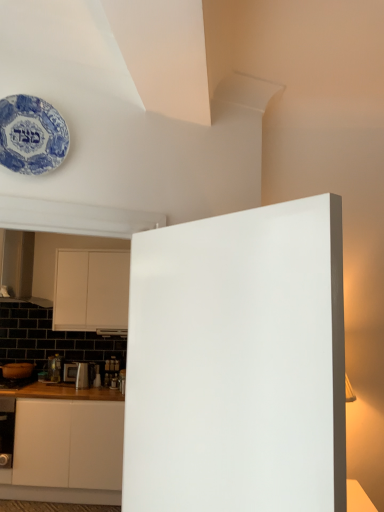
Question: In terms of height, does metallic silver toaster at lower left look taller or shorter compared to white matte cabinet at left?

Choices:
 (A) short
 (B) tall

Answer: (A)

Question: Considering the relative positions of metallic silver toaster at lower left and white matte cabinet at left in the image provided, is metallic silver toaster at lower left to the left or to the right of white matte cabinet at left?

Choices:
 (A) left
 (B) right

Answer: (A)

Question: Estimate the real-world distances between objects in this image. Which object is closer to the white matte cabinet at left?

Choices:
 (A) metallic silver toaster at lower left
 (B) blue porcelain plate at upper left
 (C) white matte door at center

Answer: (A)

Question: Based on their relative distances, which object is nearer to the blue porcelain plate at upper left?

Choices:
 (A) white matte cabinet at left
 (B) white matte door at center
 (C) metallic silver toaster at lower left

Answer: (B)